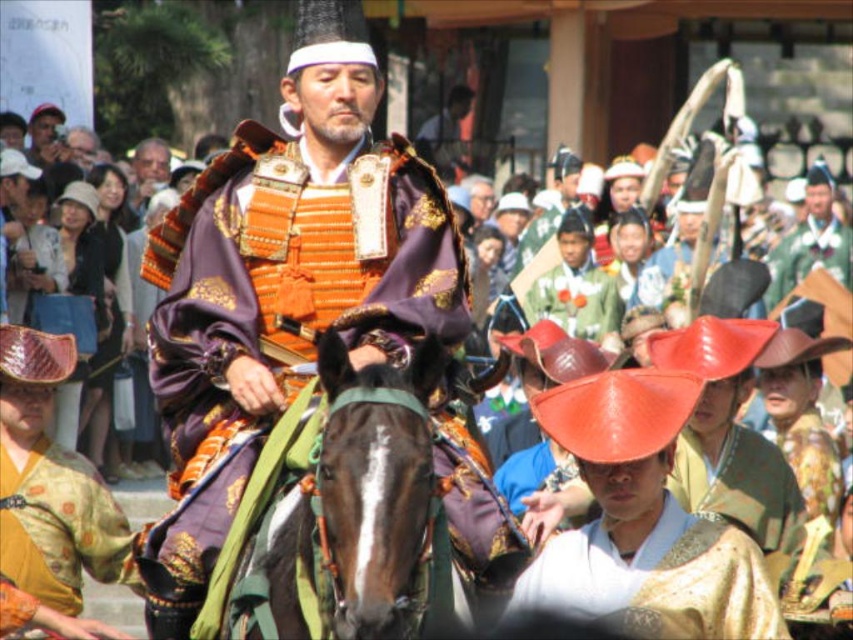
Based on the photo, you are a photographer at the festival and want to capture both the orange metallic armor at center and the gold textured kimono at center in a single shot. Which object should you position closer to the left side of your camera frame?

The orange metallic armor at center is to the left of the gold textured kimono at center, so you should position the orange metallic armor at center closer to the left side of your camera frame.

You are a photographer standing at the camera position. You want to capture a closeup shot of the orange metallic armor at center. Considering the distance, is it feasible to take the photo without moving closer?

The orange metallic armor at center is 20.73 meters away from the camera. A closeup shot would require a telephoto lens or zoom capability to capture details from that distance without moving closer.

You are a photographer at the festival. You want to capture a photo of the orange metallic armor at center and the brown glossy horse at center. Which object should you focus on first if you want to highlight the samurai rider?

The orange metallic armor at center is above the brown glossy horse at center, so you should focus on the orange metallic armor at center first to highlight the samurai rider.